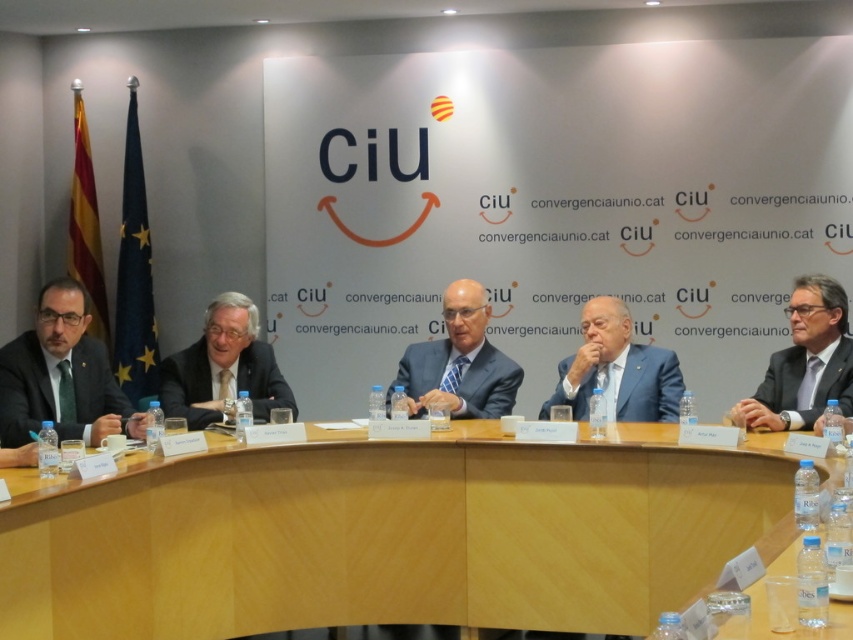
Question: Which object appears farthest from the camera in this image?

Choices:
 (A) matte black suit at right
 (B) white matte board at center
 (C) blue glossy suit at center

Answer: (B)

Question: Does white matte board at center have a lesser width compared to matte black suit at left?

Choices:
 (A) yes
 (B) no

Answer: (B)

Question: Is light blue suit at center further to the viewer compared to blue suit at center?

Choices:
 (A) no
 (B) yes

Answer: (B)

Question: Can you confirm if matte black suit at left is positioned to the left of blue suit at center?

Choices:
 (A) no
 (B) yes

Answer: (B)

Question: Which of these objects is positioned closest to the light blue suit at center?

Choices:
 (A) light brown wood table at center
 (B) blue suit at center

Answer: (A)

Question: Among these points, which one is farthest from the camera?

Choices:
 (A) (166, 493)
 (B) (839, 196)
 (C) (410, 408)

Answer: (B)